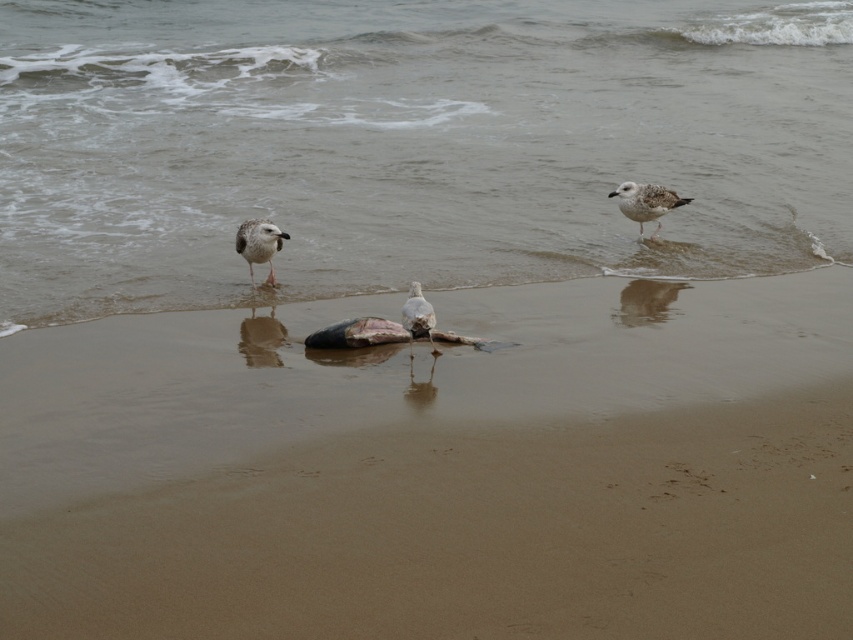
How much distance is there between brown wet sand at lower center and white feathered bird at upper right?

brown wet sand at lower center is 3.88 meters away from white feathered bird at upper right.

Which is above, brown wet sand at lower center or white feathered bird at upper right?

brown wet sand at lower center is higher up.

In the scene shown: Measure the distance between brown wet sand at lower center and camera.

brown wet sand at lower center is 5.47 meters from camera.

The height and width of the screenshot is (640, 853). Identify the location of brown wet sand at lower center. (409, 144).

Who is taller, brown wet sand at lower center or white feathered bird at center?

Standing taller between the two is brown wet sand at lower center.

Does brown wet sand at lower center have a greater height compared to white feathered bird at center?

Indeed, brown wet sand at lower center has a greater height compared to white feathered bird at center.

At what (x,y) coordinates should I click in order to perform the action: click on brown wet sand at lower center. Please return your answer as a coordinate pair (x, y). Looking at the image, I should click on (409, 144).

Where is `smooth sand at center`? smooth sand at center is located at coordinates (439, 468).

Which is in front, point (97, 563) or point (350, 292)?

Positioned in front is point (97, 563).

Where is `smooth sand at center`? smooth sand at center is located at coordinates (439, 468).